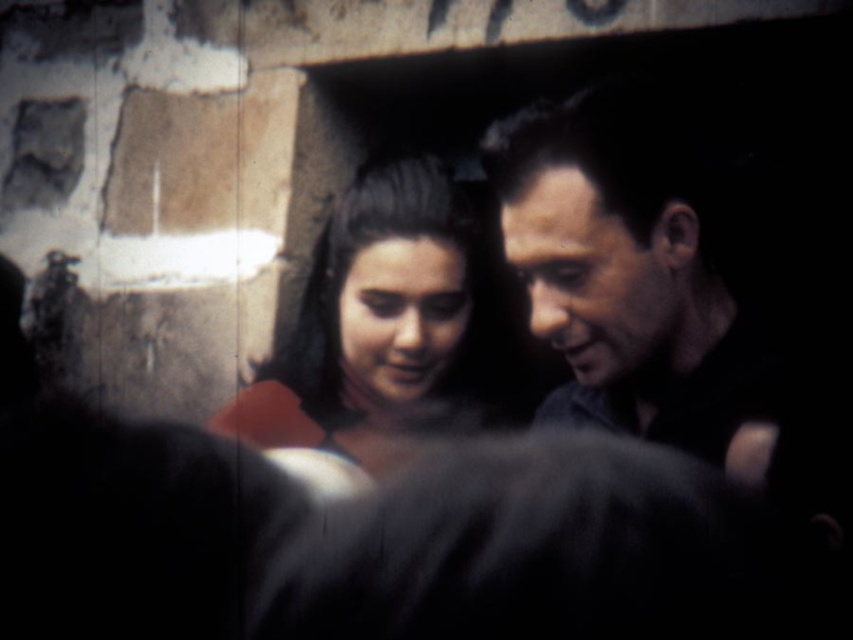
You are standing in a dimly lit room with a stone wall behind you. You see a smooth dark hair at right and a matte red dress at center. Which object is nearer to you?

The smooth dark hair at right is closer to the viewer than the matte red dress at center.

You are a photographer analyzing this vintage image. The scene has a man and a woman in dim lighting. There is a point marked at coordinates (630, 284). What does this point indicate?

The point at (630, 284) marks the location of the woman with smooth dark hair at the right side of the image.

You are a photographer analyzing this vintage image. You notice the smooth dark hair at right and the matte red dress at center. Which object occupies more horizontal space in the image?

The matte red dress at center occupies more horizontal space than the smooth dark hair at right because the smooth dark hair at right has a lesser width compared to the matte red dress at center.